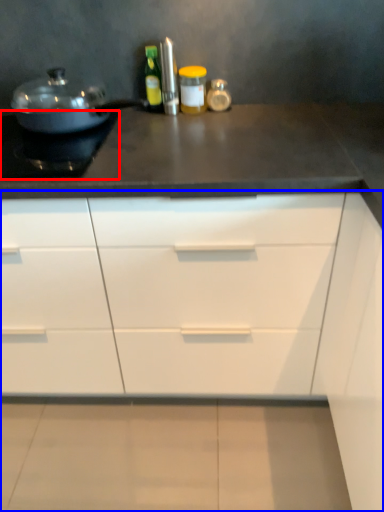
Question: Among these objects, which one is farthest to the camera, appliance (highlighted by a red box) or cabinetry (highlighted by a blue box)?

Choices:
 (A) appliance
 (B) cabinetry

Answer: (A)